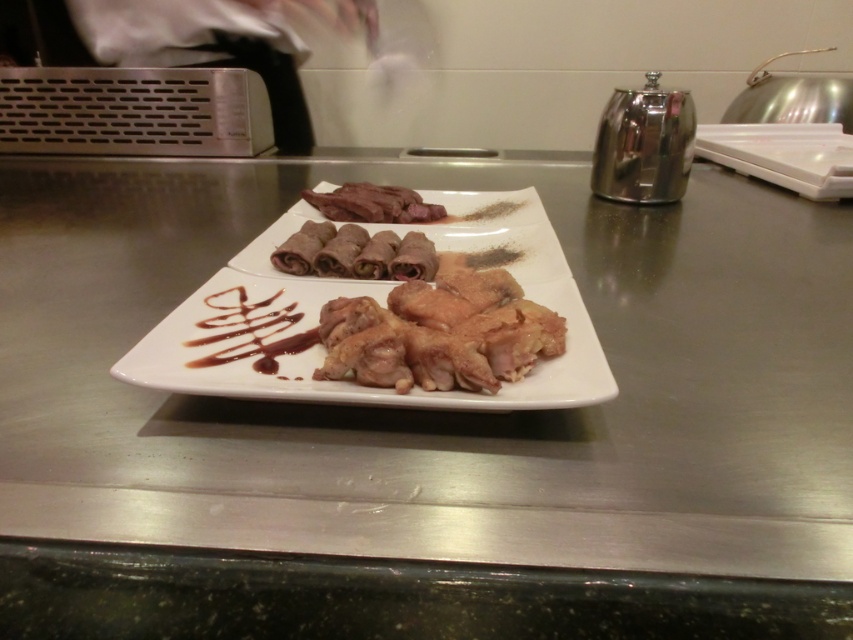
You are standing in front of the plate and want to pick up the item closest to you. Which point should you reach for, point A at point (601, 397) or point B at point (289, 102)?

You should reach for point A at point (601, 397) because it is closer to you than point B at point (289, 102).

Based on the photo, what is located at the coordinates point (380, 304)?

The white glossy plate at center is located at point (380, 304).